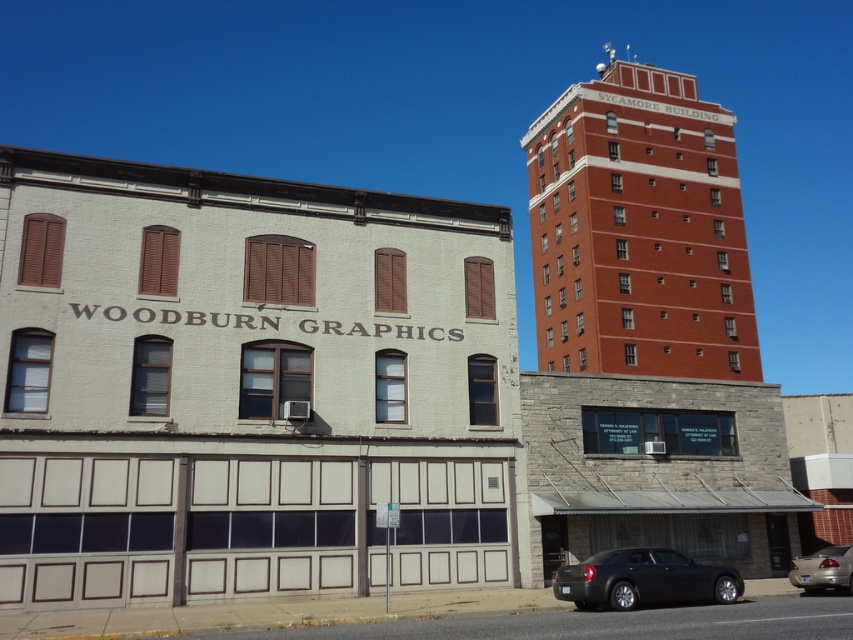
You are standing in front of the two buildings and want to determine which point is closer to you. The first point is at coordinates point (x=567, y=198) and the second is at point (x=850, y=572). Which point is closer to your position?

Point (x=567, y=198) is further to the viewer than point (x=850, y=572), so the point closer to you is point (x=850, y=572).

You are driving a car and need to park in front of the brick building at upper right. There is a matte black sedan at lower right already parked there. Can you park your car next to the sedan without moving it?

The brick building at upper right is to the right of the matte black sedan at lower right, so there might be space to park next to it depending on the available area. However, since the sedan is already occupying the spot, you would need to check if there is enough space between the sedan and the building or beyond it to park without obstructing the sedan.